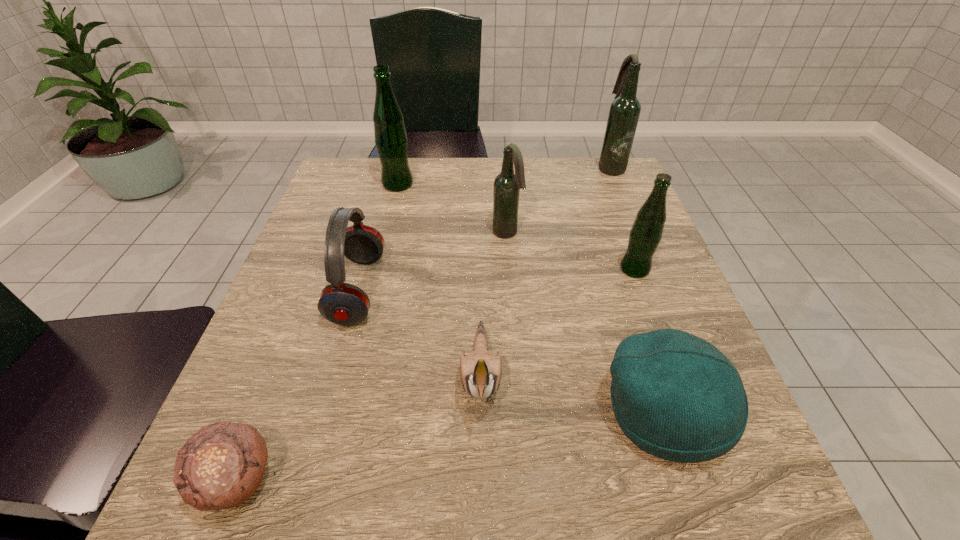
This screenshot has width=960, height=540. I want to click on the right dark beer bottle, so click(x=624, y=112).

At what (x,y) coordinates should I click in order to perform the action: click on the farther dark beer bottle. Please return your answer as a coordinate pair (x, y). This screenshot has height=540, width=960. Looking at the image, I should click on (624, 112).

Locate an element on the screen. The height and width of the screenshot is (540, 960). the bigger green beer bottle is located at coordinates (391, 140).

The height and width of the screenshot is (540, 960). I want to click on the left green beer bottle, so click(x=391, y=140).

You are a GUI agent. You are given a task and a screenshot of the screen. Output one action in this format:
    pyautogui.click(x=<x>, y=<y>)
    Task: Click on the sixth nearest object
    Image resolution: width=960 pixels, height=540 pixels.
    Given the screenshot: What is the action you would take?
    pyautogui.click(x=507, y=185)

The width and height of the screenshot is (960, 540). In order to click on the left dark beer bottle in this screenshot , I will do `click(507, 185)`.

Where is `the nearer green beer bottle`? Image resolution: width=960 pixels, height=540 pixels. the nearer green beer bottle is located at coordinates (645, 235).

Locate an element on the screen. This screenshot has width=960, height=540. the right green beer bottle is located at coordinates (645, 235).

At what (x,y) coordinates should I click in order to perform the action: click on red earphone. Please return your answer as a coordinate pair (x, y). Looking at the image, I should click on (341, 303).

Find the location of a particular element. The width and height of the screenshot is (960, 540). bird is located at coordinates (480, 371).